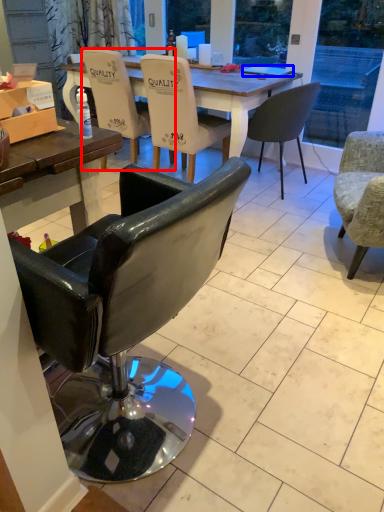
Question: Among these objects, which one is farthest to the camera, chair (highlighted by a red box) or laptop (highlighted by a blue box)?

Choices:
 (A) chair
 (B) laptop

Answer: (B)